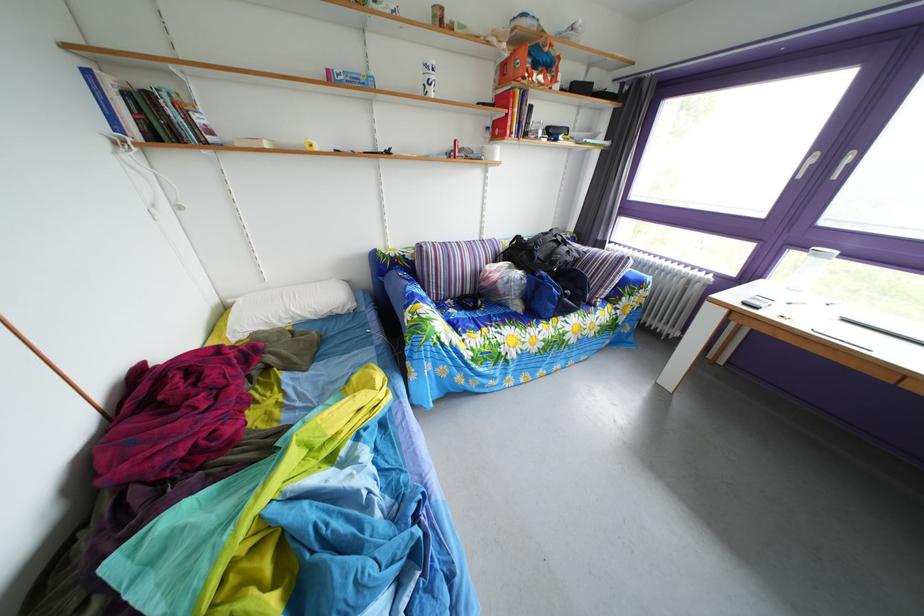
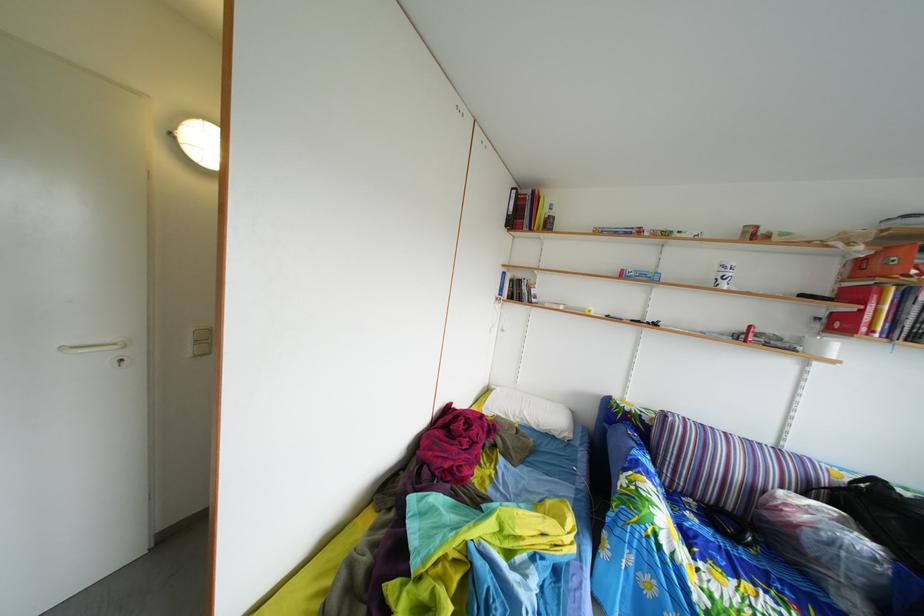
Where in the second image is the point corresponding to [432,79] from the first image?

(727, 276)